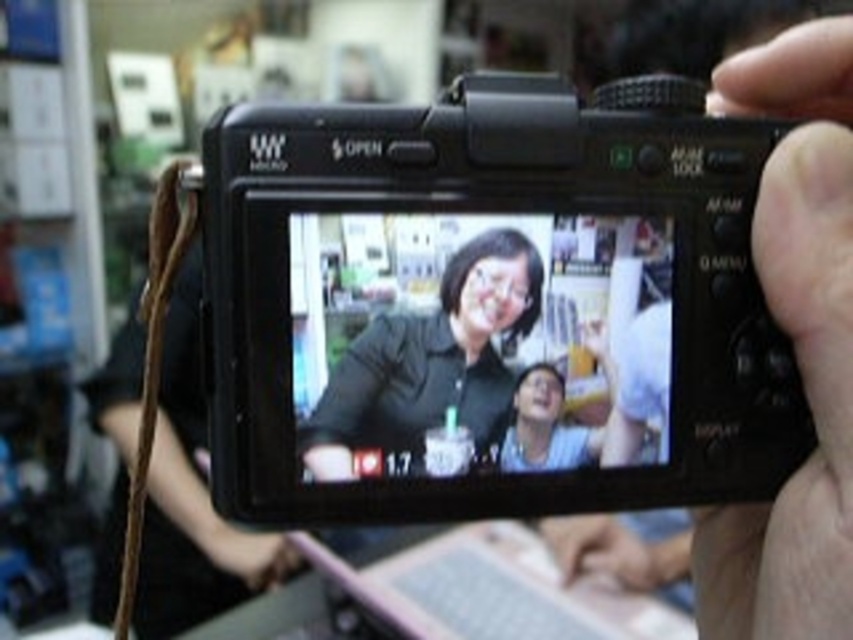
Question: Estimate the real-world distances between objects in this image. Which object is closer to the black matte camera at right?

Choices:
 (A) black plastic camera at center
 (B) matte black shirt at center

Answer: (A)

Question: Is black matte camera at right bigger than matte black shirt at center?

Choices:
 (A) no
 (B) yes

Answer: (B)

Question: Which point is closer to the camera?

Choices:
 (A) tap(279, 348)
 (B) tap(515, 296)

Answer: (A)

Question: Among these points, which one is farthest from the camera?

Choices:
 (A) (834, 410)
 (B) (730, 326)

Answer: (B)

Question: From the image, what is the correct spatial relationship of black plastic camera at center in relation to black matte camera at right?

Choices:
 (A) left
 (B) right

Answer: (A)

Question: From the image, what is the correct spatial relationship of black matte camera at right in relation to matte black shirt at center?

Choices:
 (A) right
 (B) left

Answer: (A)